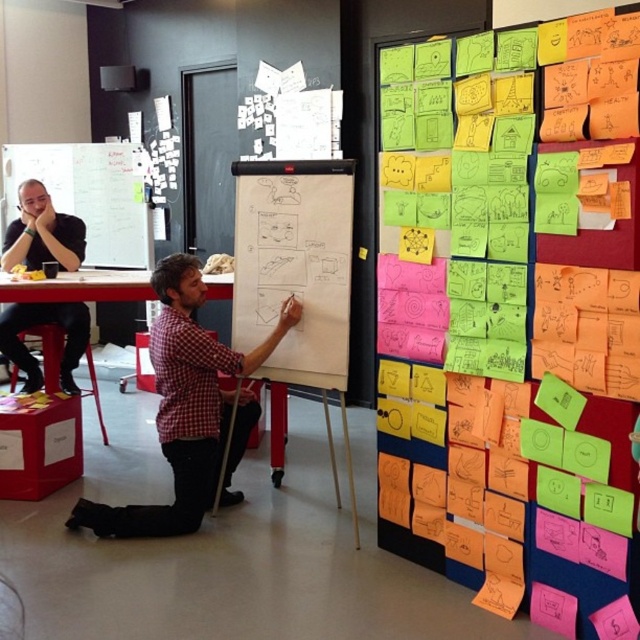
Question: Which object appears farthest from the camera in this image?

Choices:
 (A) whiteboard at upper left
 (B) red plastic stool at lower left
 (C) red plastic table at center
 (D) white paperboard at center

Answer: (A)

Question: Is white paperboard at center behind black matte shirt at upper left?

Choices:
 (A) no
 (B) yes

Answer: (A)

Question: In this image, where is red checkered shirt at center located relative to red plastic table at center?

Choices:
 (A) right
 (B) left

Answer: (A)

Question: Is white paperboard at center to the left of red checkered shirt at center from the viewer's perspective?

Choices:
 (A) no
 (B) yes

Answer: (A)

Question: Among these objects, which one is farthest from the camera?

Choices:
 (A) black matte shirt at upper left
 (B) red checkered shirt at center

Answer: (A)

Question: Which point is closer to the camera?

Choices:
 (A) black matte shirt at upper left
 (B) red plastic table at center
 (C) white paperboard at center

Answer: (C)